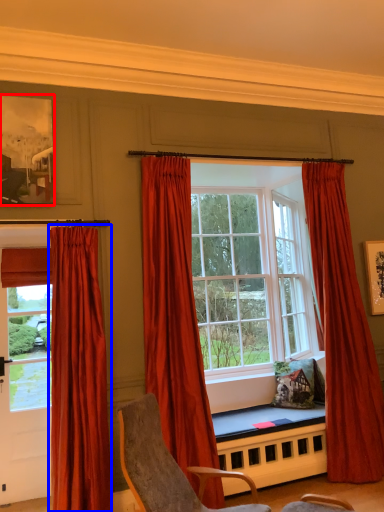
Question: Which of the following is the farthest to the observer, picture frame (highlighted by a red box) or curtain (highlighted by a blue box)?

Choices:
 (A) picture frame
 (B) curtain

Answer: (A)